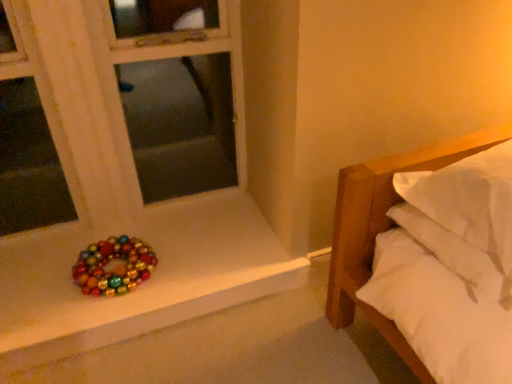
The height and width of the screenshot is (384, 512). I want to click on free space to the left of glossy multicolored beads at lower left, so click(x=42, y=280).